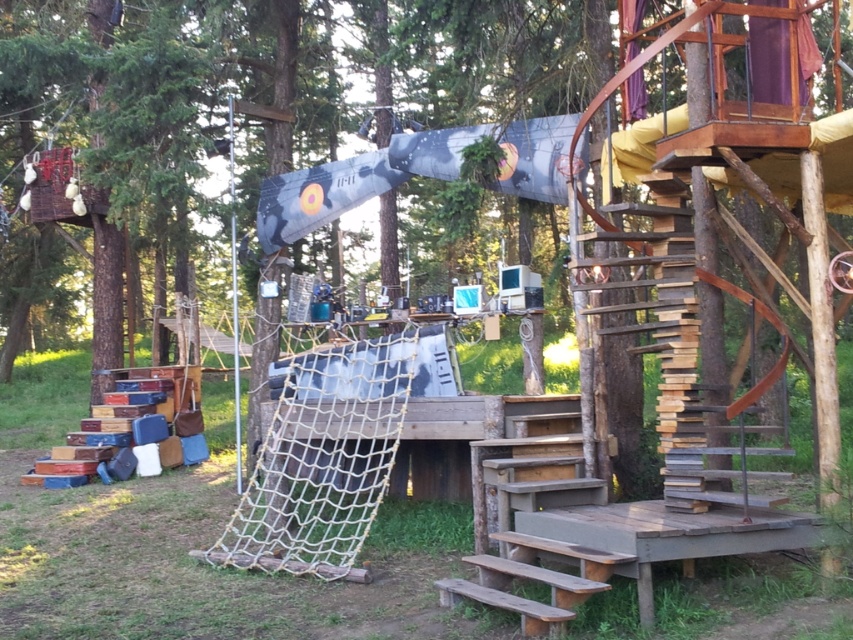
You are standing at the base of the wooden staircase leading up to the platform. You want to reach the white rope net at center. Which direction should you move towards?

You should move towards the center to reach the white rope net at center since it is located at the center of the scene.

You are standing at the base of the wooden staircase and want to reach the top platform. The white rope net at center is in your way. Can you walk around it to reach the platform?

The white rope net at center is 6.19 meters away from you, so you can walk around it to reach the platform.